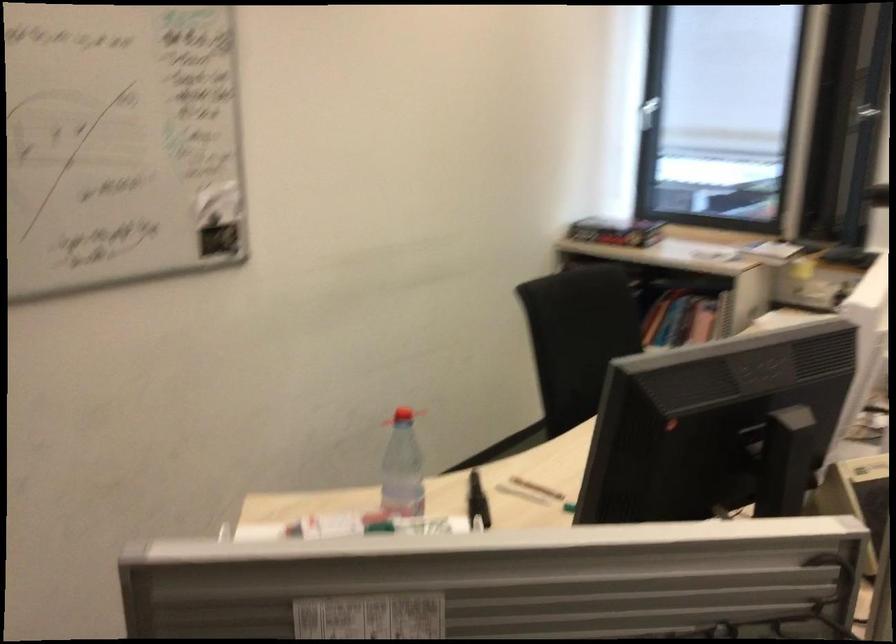
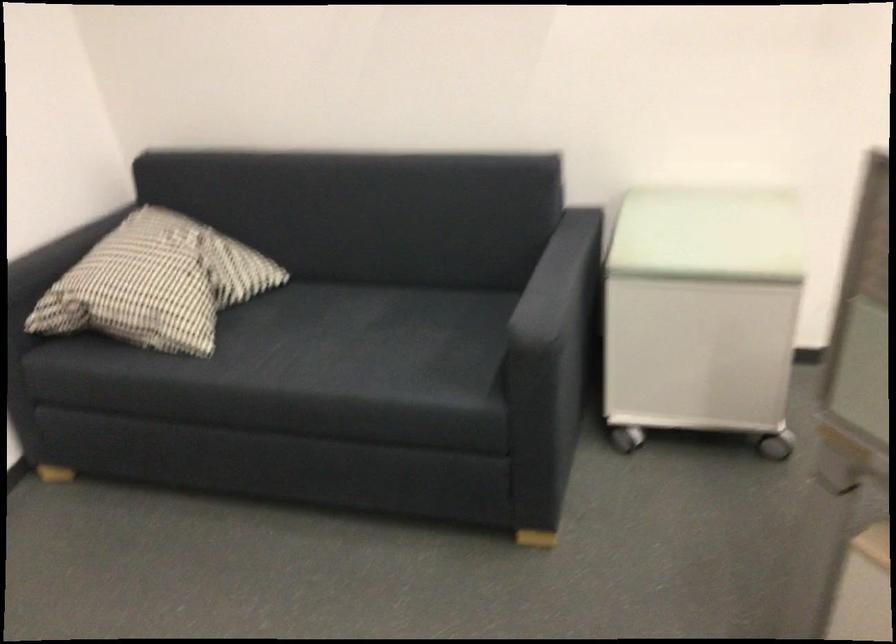
The first image is from the beginning of the video and the second image is from the end. How did the camera likely rotate when shooting the video?

The camera rotated toward left-down.